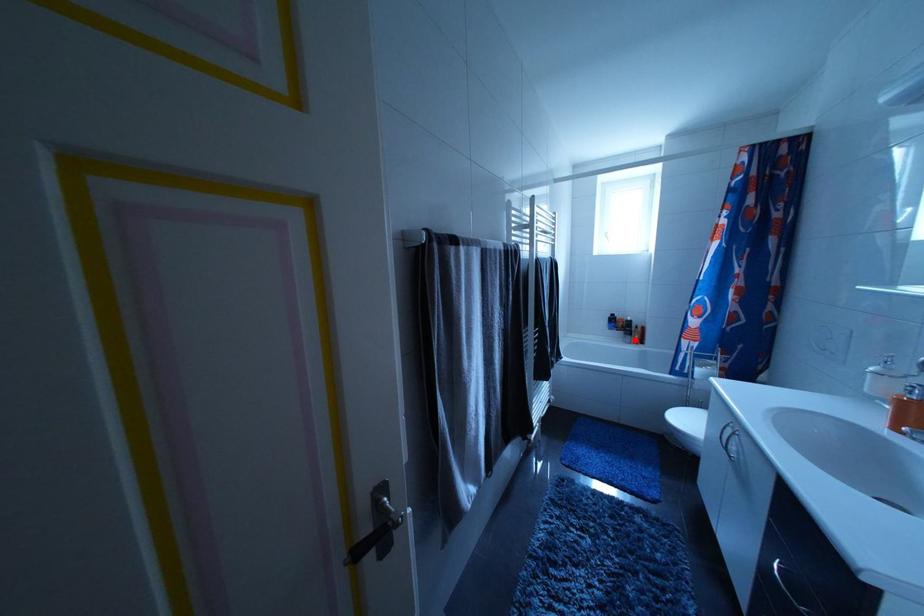
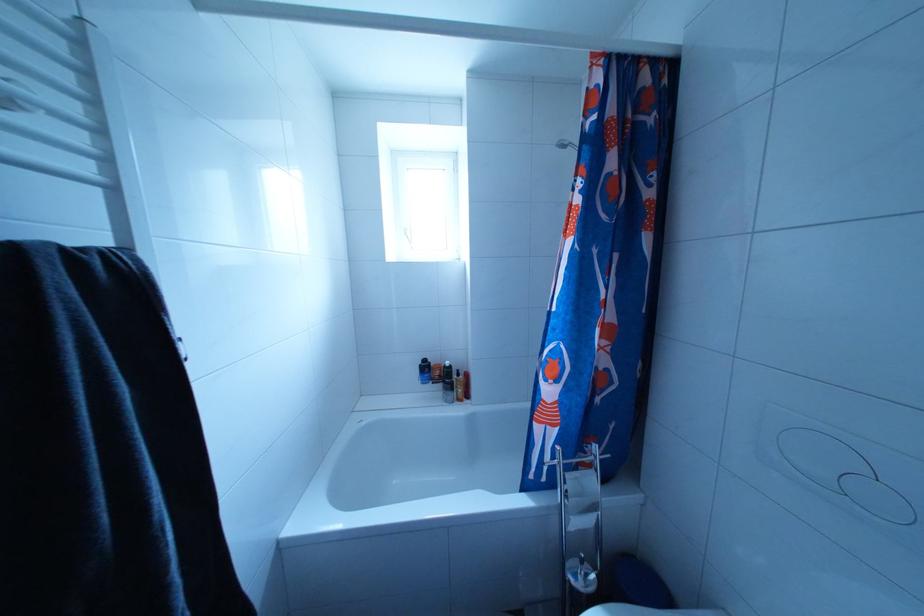
In the second image, find the point that corresponds to the highlighted location in the first image.

(455, 395)